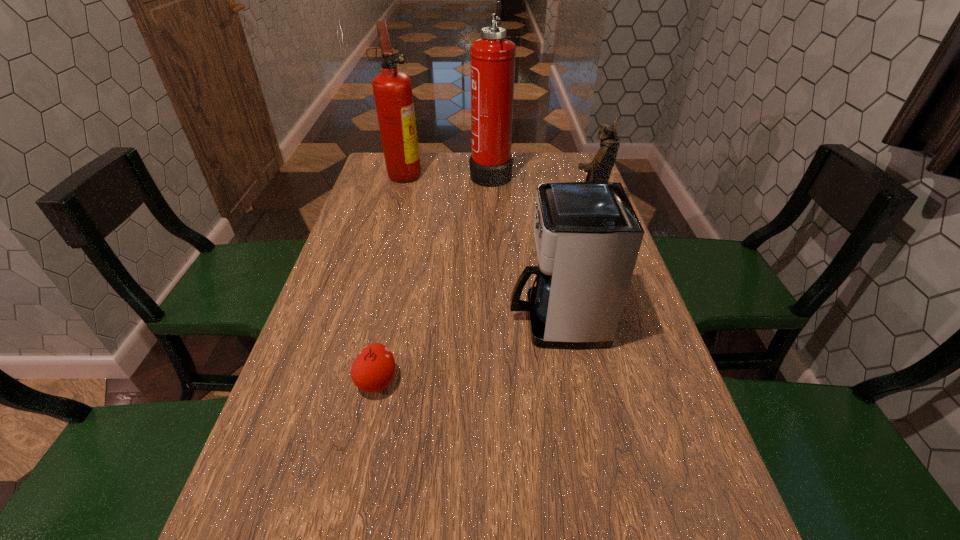
Locate an element on the screen. object that stands as the closest to the shorter fire extinguisher is located at coordinates (492, 58).

At what (x,y) coordinates should I click in order to perform the action: click on object that stands as the closest to the third farthest object. Please return your answer as a coordinate pair (x, y). The image size is (960, 540). Looking at the image, I should click on (492, 58).